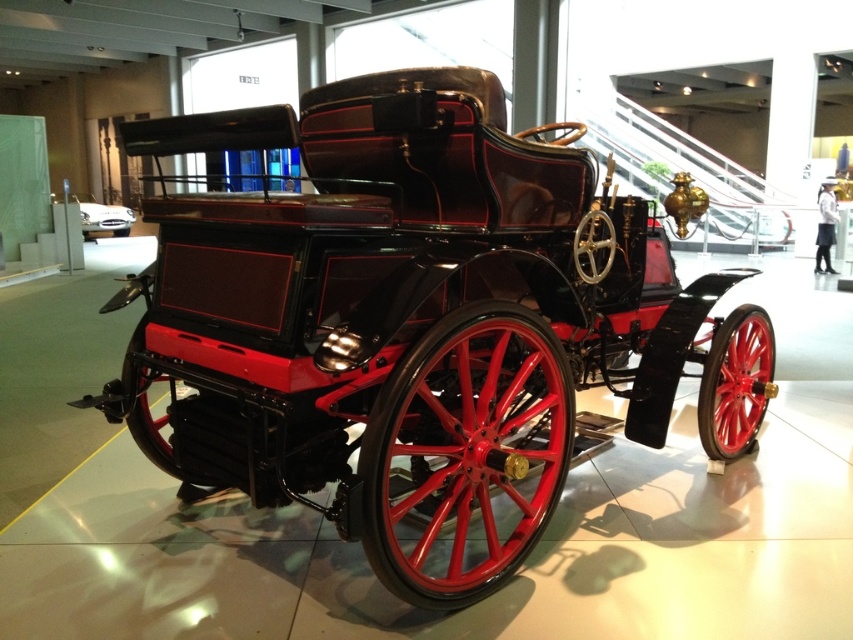
Can you confirm if shiny black car at center is bigger than polished wood coach at center?

Incorrect, shiny black car at center is not larger than polished wood coach at center.

Who is more distant from viewer, (61,202) or (828,266)?

The point (828,266) is more distant.

This screenshot has height=640, width=853. Identify the location of shiny black car at center. (102, 216).

What do you see at coordinates (415, 323) in the screenshot?
I see `shiny black wagon at center` at bounding box center [415, 323].

Between point (315, 131) and point (83, 209), which one is positioned behind?

Positioned behind is point (83, 209).

Is point (488, 284) less distant than point (126, 225)?

Yes, point (488, 284) is in front of point (126, 225).

The image size is (853, 640). In order to click on shiny black wagon at center in this screenshot , I will do `click(415, 323)`.

Is shiny black wagon at center below polished wood coach at center?

Yes, shiny black wagon at center is below polished wood coach at center.

You are a GUI agent. You are given a task and a screenshot of the screen. Output one action in this format:
    pyautogui.click(x=<x>, y=<y>)
    Task: Click on the shiny black wagon at center
    Image resolution: width=853 pixels, height=640 pixels.
    Given the screenshot: What is the action you would take?
    pyautogui.click(x=415, y=323)

Where is `shiny black wagon at center`? shiny black wagon at center is located at coordinates (415, 323).

This screenshot has width=853, height=640. Identify the location of shiny black wagon at center. (415, 323).